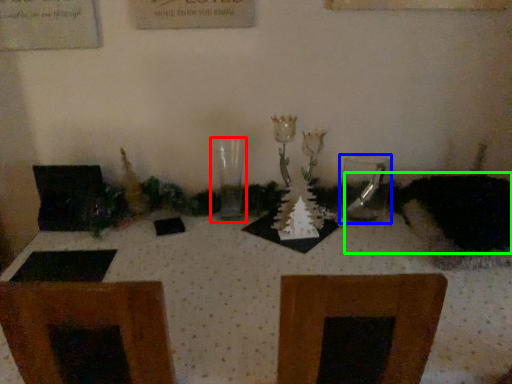
Question: Which object is the closest to the candle holder (highlighted by a red box)? Choose among these: tableware (highlighted by a blue box) or animal (highlighted by a green box).

Choices:
 (A) tableware
 (B) animal

Answer: (A)